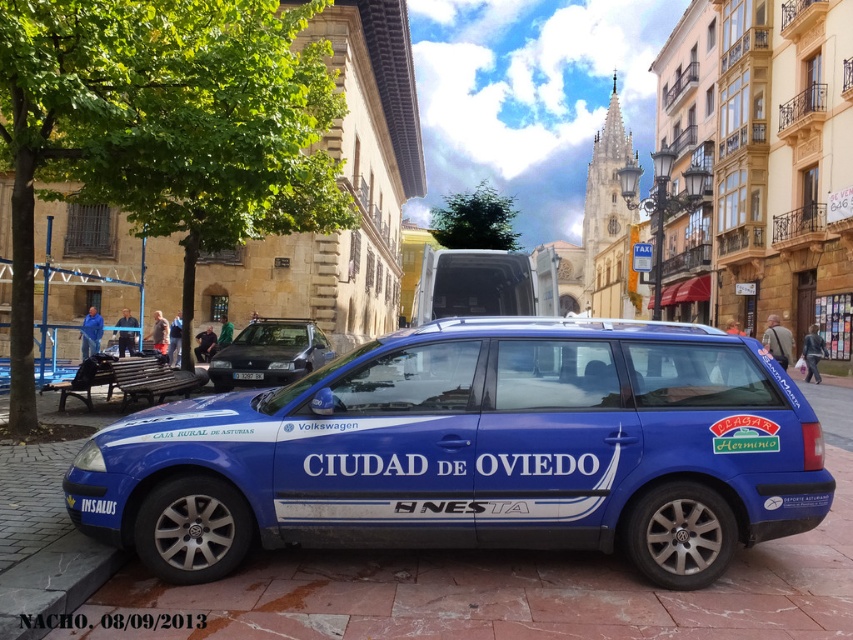
Question: Can you confirm if blue metallic car at center is wider than black plastic license plate at center?

Choices:
 (A) no
 (B) yes

Answer: (B)

Question: Which point is closer to the camera?

Choices:
 (A) blue metallic car at center
 (B) white matte van at center

Answer: (A)

Question: From the image, what is the correct spatial relationship of blue metallic car at center in relation to black plastic license plate at center?

Choices:
 (A) below
 (B) above

Answer: (A)

Question: Is white matte van at center further to the viewer compared to shiny black sedan at center?

Choices:
 (A) yes
 (B) no

Answer: (B)

Question: Estimate the real-world distances between objects in this image. Which object is farther from the shiny black sedan at center?

Choices:
 (A) blue metallic car at center
 (B) white matte van at center
 (C) black plastic license plate at center

Answer: (A)

Question: Which object is the closest to the shiny black sedan at center?

Choices:
 (A) blue metallic car at center
 (B) black plastic license plate at center

Answer: (B)